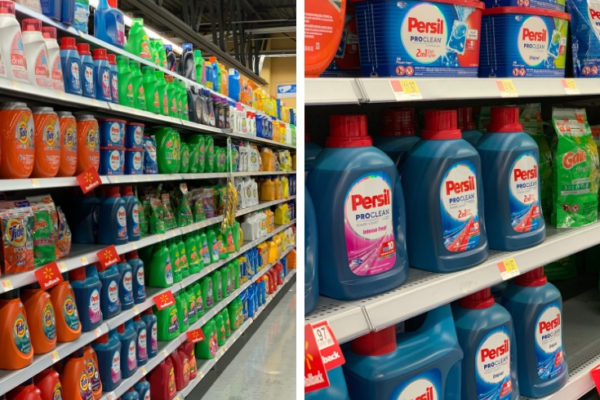
Identify the location of grocery store shelves. This screenshot has width=600, height=400. (193, 84), (151, 114), (147, 176), (154, 236), (189, 282), (217, 309), (233, 337).